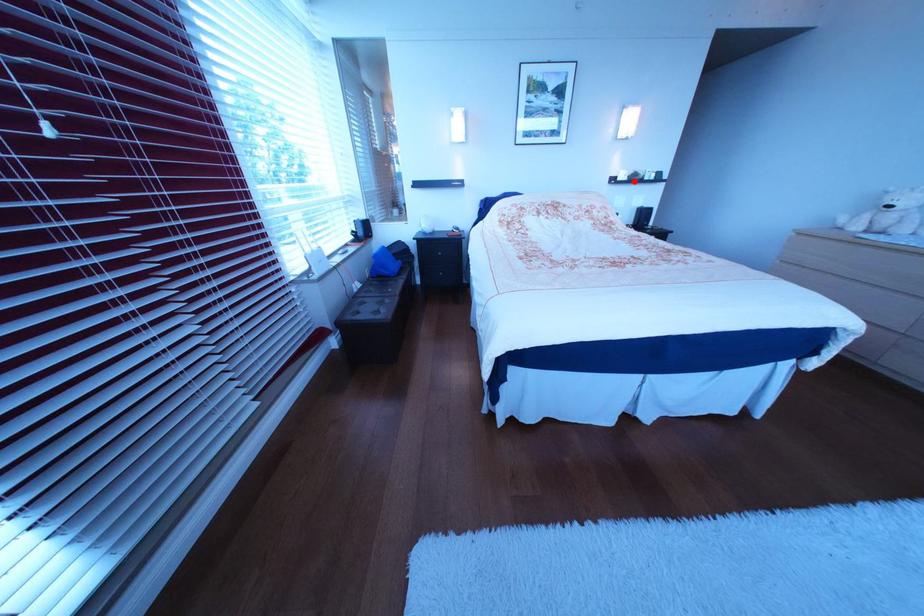
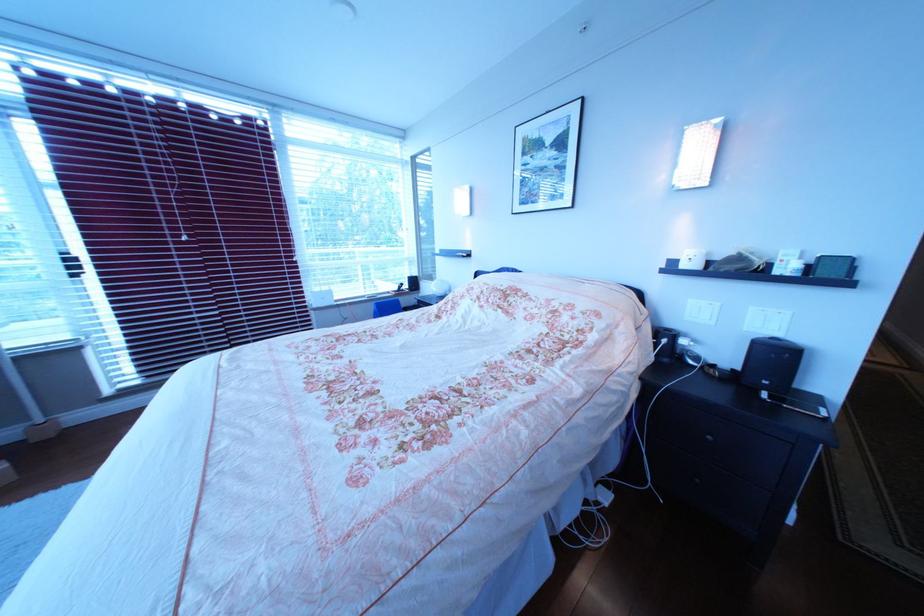
Question: I am providing you with two images of the same scene from different viewpoints. A red point is shown in image1. For the corresponding object point in image2, is it positioned nearer or farther from the camera?

Choices:
 (A) Nearer
 (B) Farther

Answer: (B)